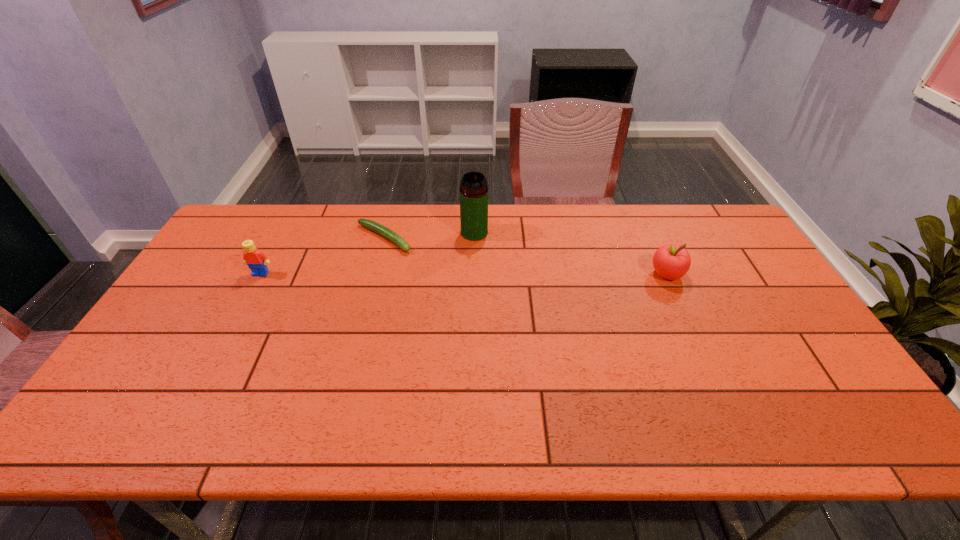
You are a GUI agent. You are given a task and a screenshot of the screen. Output one action in this format:
    pyautogui.click(x=<x>, y=<y>)
    Task: Click on the blank region between the second object from right to left and the apple
    The image size is (960, 540).
    Given the screenshot: What is the action you would take?
    pyautogui.click(x=570, y=253)

Identify which object is located as the second nearest to the leftmost object. Please provide its 2D coordinates. Your answer should be formatted as a tuple, i.e. [(x, y)], where the tuple contains the x and y coordinates of a point satisfying the conditions above.

[(473, 189)]

Point out which object is positioned as the second nearest to the third object from right to left. Please provide its 2D coordinates. Your answer should be formatted as a tuple, i.e. [(x, y)], where the tuple contains the x and y coordinates of a point satisfying the conditions above.

[(256, 260)]

Identify the location of free region that satisfies the following two spatial constraints: 1. on the face of the Lego; 2. on the right side of the rightmost object. This screenshot has width=960, height=540. (260, 274).